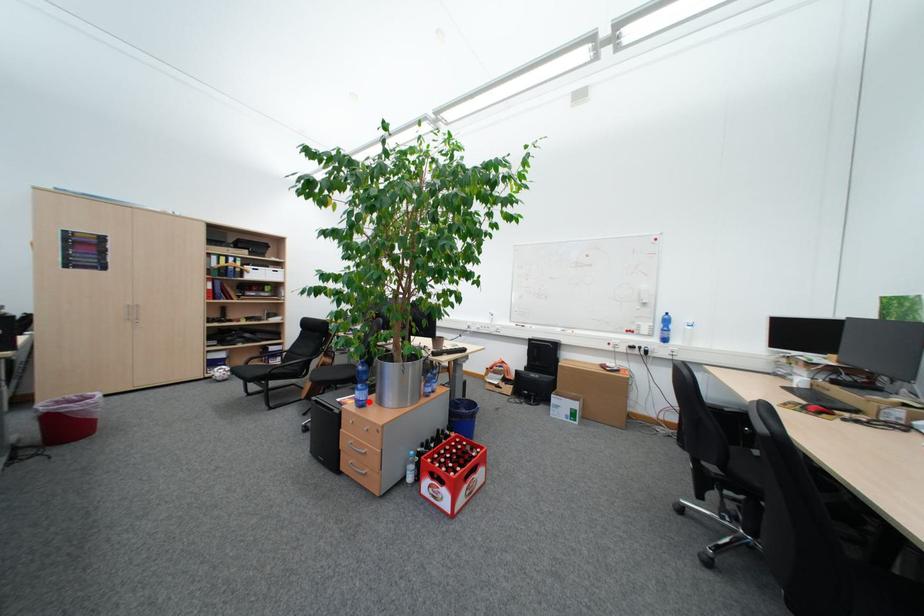
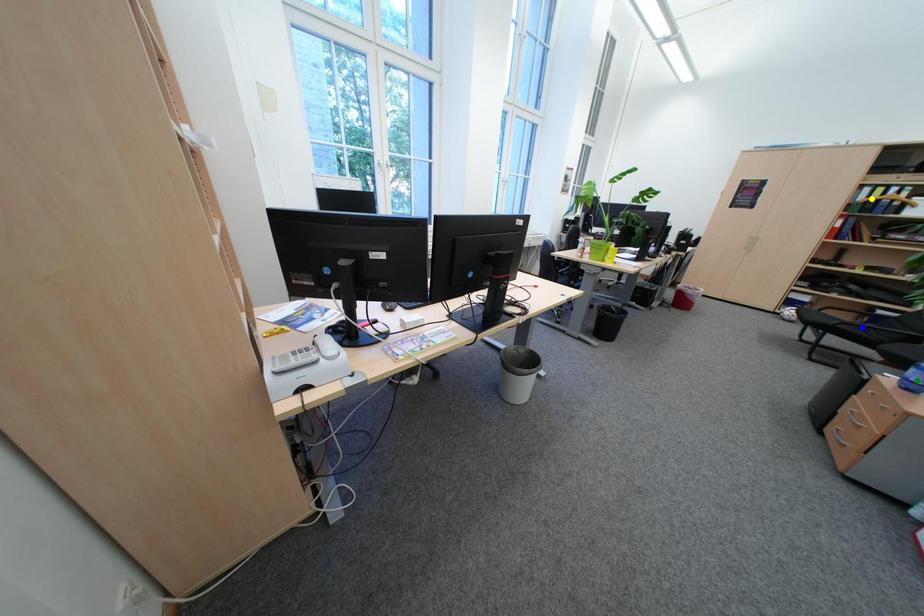
Question: I am providing you with two images of the same scene from different viewpoints. A red point is marked on the first image. You are given multiple points on the second image. Which point in image 2 is actually the same real-world point as the red point in image 1?

Choices:
 (A) green point
 (B) yellow point
 (C) blue point

Answer: (A)